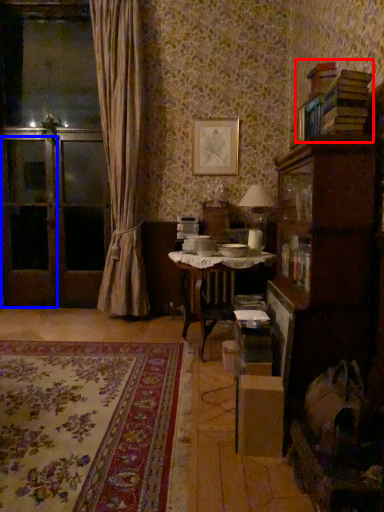
Question: Which of the following is the closest to the observer, book (highlighted by a red box) or screen door (highlighted by a blue box)?

Choices:
 (A) book
 (B) screen door

Answer: (A)